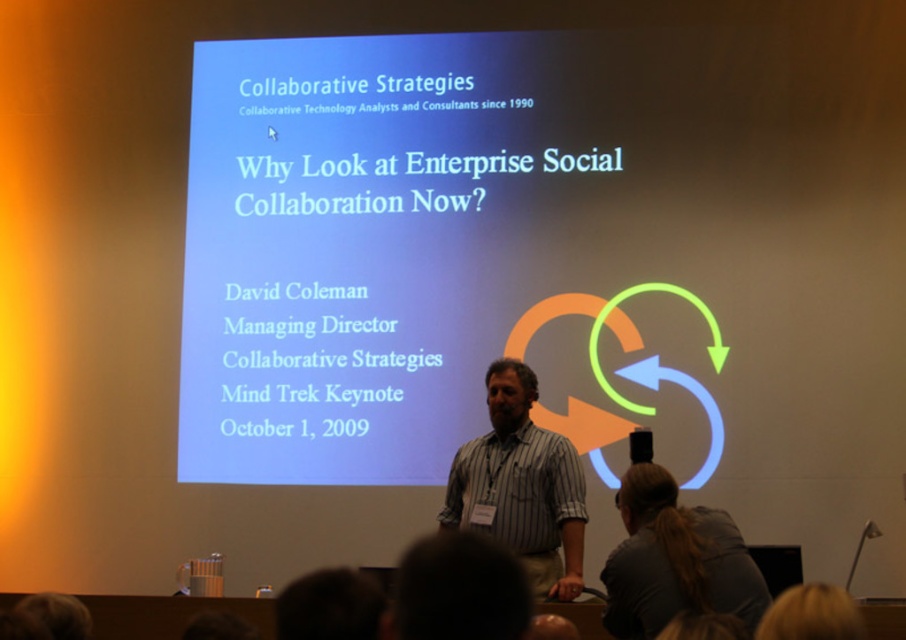
Which is below, striped cotton shirt at center or blonde hair at upper center?

striped cotton shirt at center is below.

Describe the element at coordinates (521, 484) in the screenshot. I see `striped cotton shirt at center` at that location.

This screenshot has height=640, width=906. I want to click on striped cotton shirt at center, so (521, 484).

Is point (701, 524) closer to camera compared to point (832, 592)?

No, (701, 524) is further to viewer.

Between gray fabric ponytail at lower center and blonde hair at upper center, which one is positioned lower?

blonde hair at upper center is below.

Does point (738, 580) come farther from viewer compared to point (767, 614)?

That is True.

Where is `gray fabric ponytail at lower center`? gray fabric ponytail at lower center is located at coordinates (673, 561).

Is gray fabric ponytail at lower center closer to the viewer compared to dark hair at lower center?

No, it is behind dark hair at lower center.

You are a GUI agent. You are given a task and a screenshot of the screen. Output one action in this format:
    pyautogui.click(x=<x>, y=<y>)
    Task: Click on the gray fabric ponytail at lower center
    The width and height of the screenshot is (906, 640).
    Given the screenshot: What is the action you would take?
    pyautogui.click(x=673, y=561)

The height and width of the screenshot is (640, 906). Find the location of `gray fabric ponytail at lower center`. gray fabric ponytail at lower center is located at coordinates (673, 561).